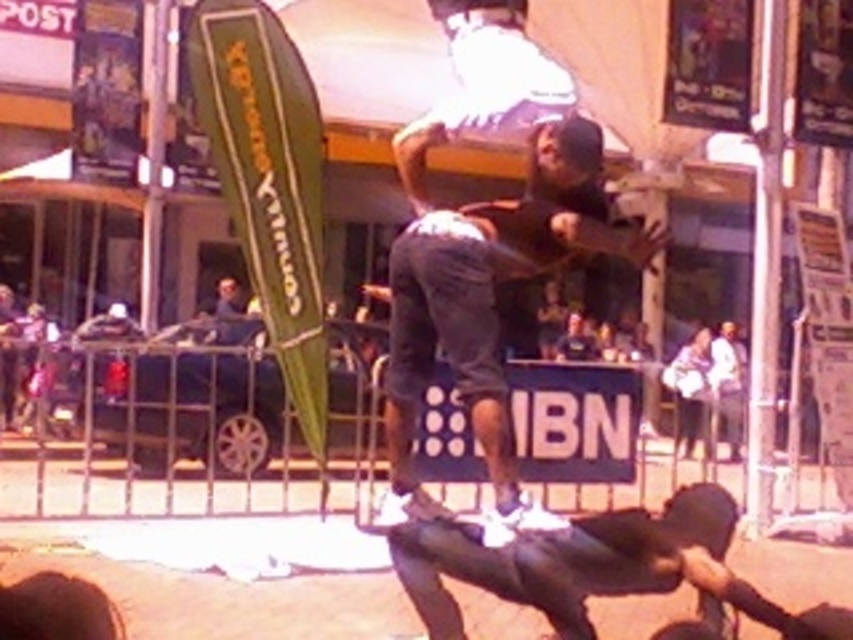
Question: From the image, what is the correct spatial relationship of dark gray denim shorts at center in relation to dark gray matte skateboard at lower center?

Choices:
 (A) left
 (B) right

Answer: (A)

Question: Where is dark gray denim shorts at center located in relation to dark gray matte skateboard at lower center in the image?

Choices:
 (A) below
 (B) above

Answer: (B)

Question: Which object appears farthest from the camera in this image?

Choices:
 (A) dark gray matte skateboard at lower center
 (B) dark gray denim shorts at center

Answer: (B)

Question: Does dark gray denim shorts at center have a larger size compared to dark gray matte skateboard at lower center?

Choices:
 (A) no
 (B) yes

Answer: (B)

Question: Which point appears closest to the camera in this image?

Choices:
 (A) (497, 224)
 (B) (485, 548)

Answer: (B)